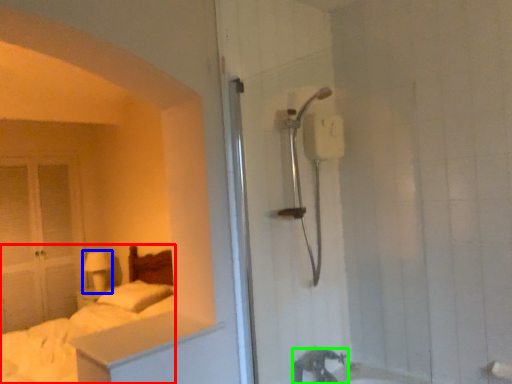
Question: Considering the real-world distances, which object is closest to bed (highlighted by a red box)? lamp (highlighted by a blue box) or tap (highlighted by a green box).

Choices:
 (A) lamp
 (B) tap

Answer: (A)